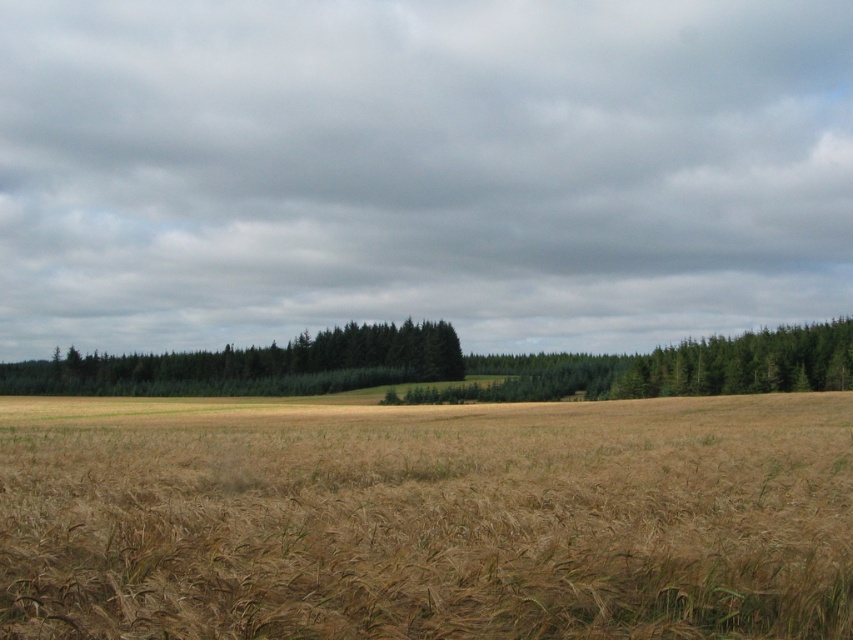
Does brown grassy field at center have a greater width compared to green textured trees at center?

In fact, brown grassy field at center might be narrower than green textured trees at center.

Measure the distance from brown grassy field at center to green textured trees at center.

82.81 meters

Does point (807, 586) come in front of point (183, 371)?

Yes, point (807, 586) is in front of point (183, 371).

I want to click on brown grassy field at center, so click(426, 518).